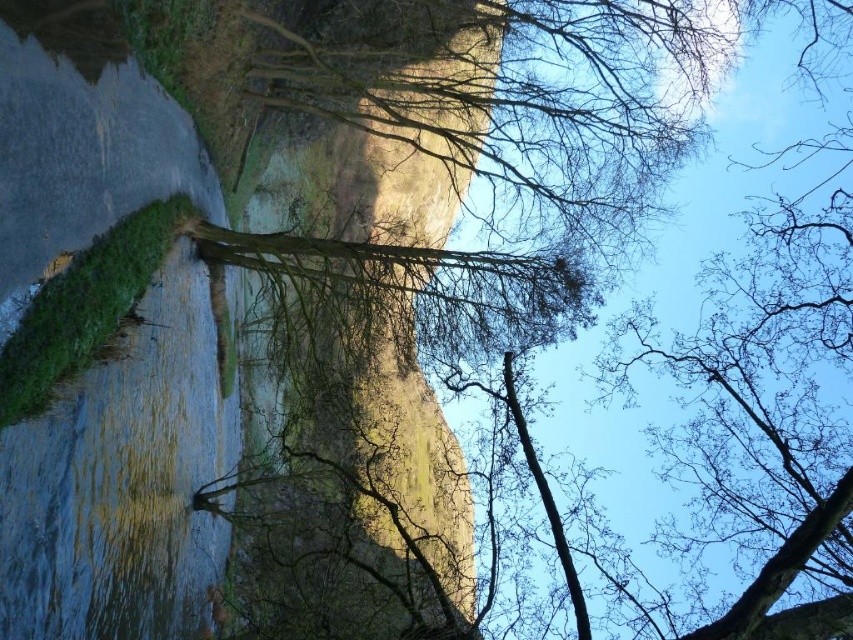
Question: Can you confirm if rustic stone cliff at center is positioned to the left of smooth rock cliff at left?

Choices:
 (A) yes
 (B) no

Answer: (B)

Question: Can you confirm if rustic stone cliff at center is positioned to the left of smooth rock cliff at left?

Choices:
 (A) yes
 (B) no

Answer: (B)

Question: Among these points, which one is nearest to the camera?

Choices:
 (A) (259, 305)
 (B) (44, 45)

Answer: (B)

Question: Can you confirm if rustic stone cliff at center is positioned below smooth rock cliff at left?

Choices:
 (A) yes
 (B) no

Answer: (B)